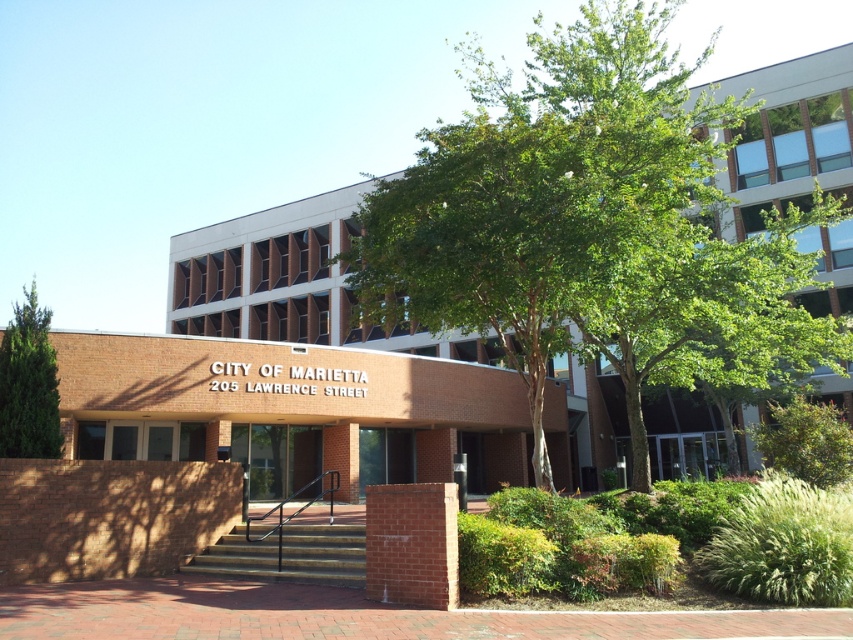
Question: Which point is closer to the camera?

Choices:
 (A) green leafy tree at center
 (B) concrete steps at center
 (C) green leafy tree at left

Answer: (A)

Question: Which point is closer to the camera?

Choices:
 (A) green leafy tree at center
 (B) concrete steps at center
 (C) green leafy tree at left

Answer: (A)

Question: Can you confirm if concrete steps at center is wider than green leafy tree at left?

Choices:
 (A) yes
 (B) no

Answer: (B)

Question: Is concrete steps at center further to camera compared to green leafy tree at left?

Choices:
 (A) no
 (B) yes

Answer: (A)

Question: Is green leafy tree at center positioned in front of green leafy tree at left?

Choices:
 (A) no
 (B) yes

Answer: (B)

Question: Which object is farther from the camera taking this photo?

Choices:
 (A) concrete steps at center
 (B) green leafy tree at center

Answer: (A)